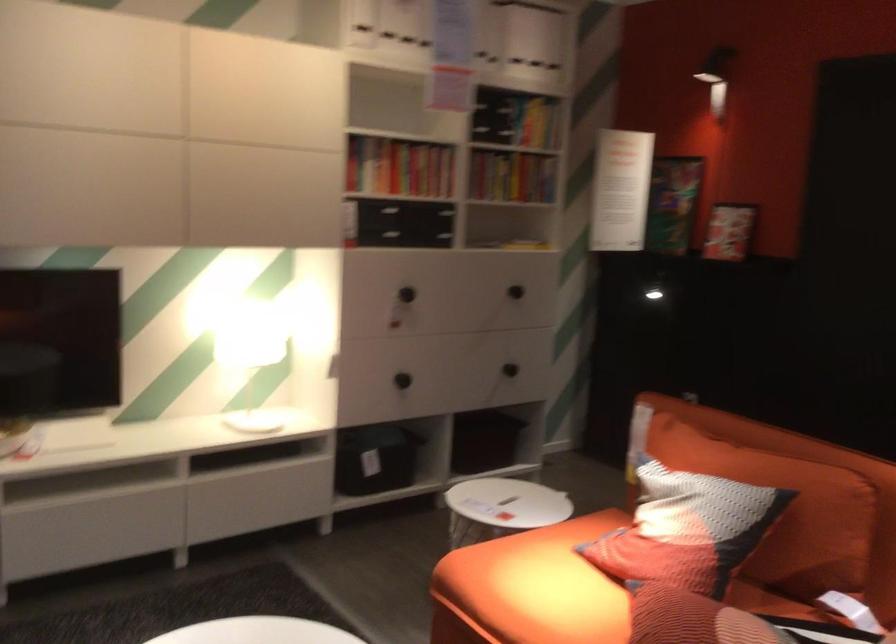
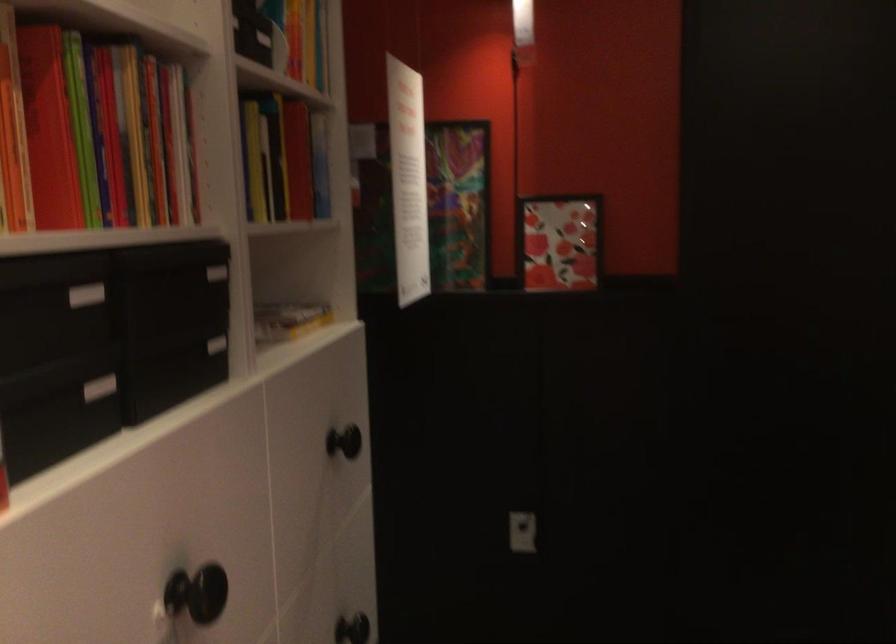
Find the pixel in the second image that matches pixel 734 207 in the first image.

(560, 242)